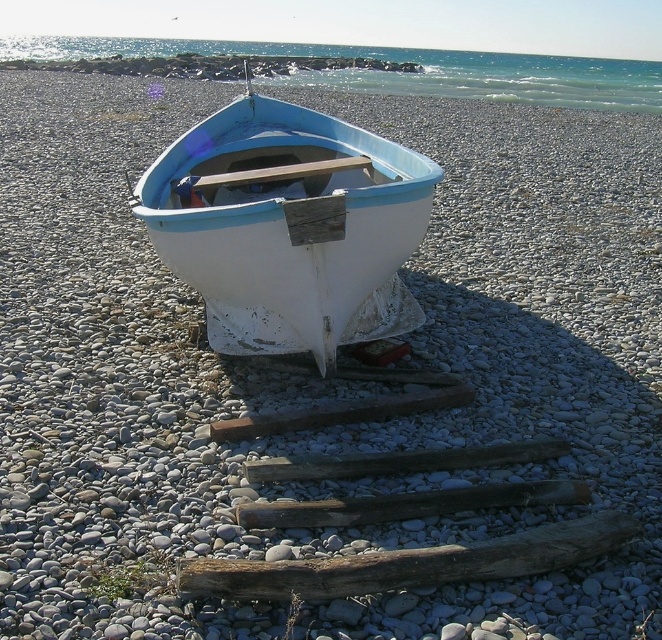
Question: Does white matte boat at center have a lesser width compared to weathered wood log at center?

Choices:
 (A) yes
 (B) no

Answer: (B)

Question: Which point appears closest to the camera in this image?

Choices:
 (A) (177, 257)
 (B) (465, 572)

Answer: (B)

Question: Which point is farther from the camera taking this photo?

Choices:
 (A) (261, 104)
 (B) (577, 552)

Answer: (A)

Question: Which point is farther from the camera taking this photo?

Choices:
 (A) (250, 561)
 (B) (197, 280)

Answer: (B)

Question: Can you confirm if white matte boat at center is positioned to the left of weathered wood log at center?

Choices:
 (A) no
 (B) yes

Answer: (B)

Question: Does white matte boat at center have a lesser width compared to weathered wood log at center?

Choices:
 (A) no
 (B) yes

Answer: (A)